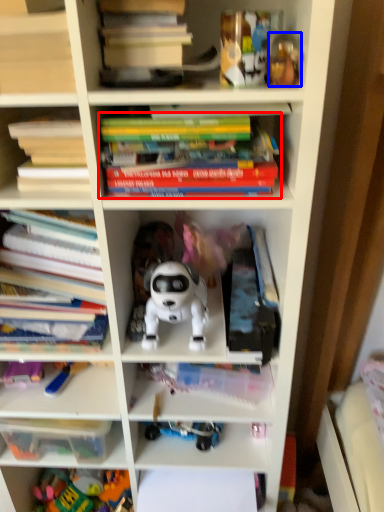
Question: Which of the following is the closest to the observer, book (highlighted by a red box) or toy (highlighted by a blue box)?

Choices:
 (A) book
 (B) toy

Answer: (B)